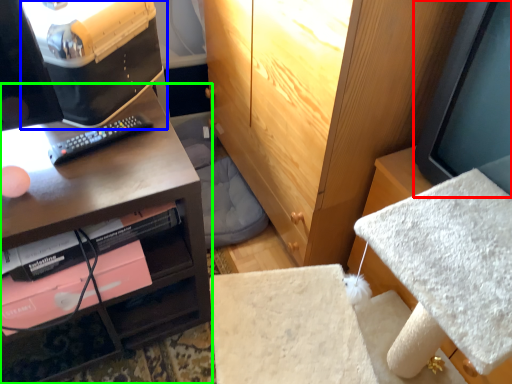
Question: Which object is the farthest from computer monitor (highlighted by a red box)? Choose among these: desktop computer (highlighted by a blue box) or desk (highlighted by a green box).

Choices:
 (A) desktop computer
 (B) desk

Answer: (A)